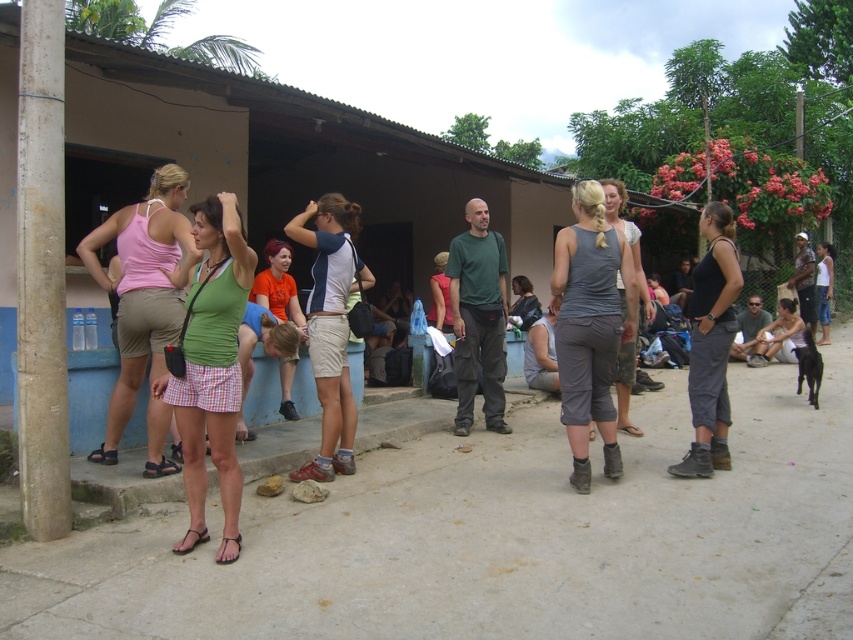
Between black fabric tank top at center and light pink fabric shirt at center, which one appears on the left side from the viewer's perspective?

black fabric tank top at center is more to the left.

Does point (720, 256) lie behind point (825, 301)?

No, (720, 256) is closer to viewer.

The image size is (853, 640). I want to click on black fabric tank top at center, so pos(711,344).

Does gray fabric pants at center have a larger size compared to light pink fabric shirt at center?

No.

What do you see at coordinates (590, 326) in the screenshot?
I see `gray fabric pants at center` at bounding box center [590, 326].

Image resolution: width=853 pixels, height=640 pixels. What do you see at coordinates (590, 326) in the screenshot? I see `gray fabric pants at center` at bounding box center [590, 326].

Locate an element on the screen. gray fabric pants at center is located at coordinates pos(590,326).

Is matte blue and white shirt at center to the right of orange t-shirt at center from the viewer's perspective?

Yes, matte blue and white shirt at center is to the right of orange t-shirt at center.

The height and width of the screenshot is (640, 853). I want to click on matte blue and white shirt at center, so click(329, 326).

The image size is (853, 640). I want to click on matte blue and white shirt at center, so click(329, 326).